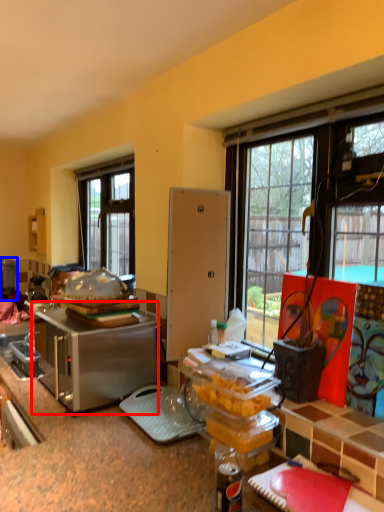
Question: Which point is closer to the camera, appliance (highlighted by a red box) or appliance (highlighted by a blue box)?

Choices:
 (A) appliance
 (B) appliance

Answer: (A)